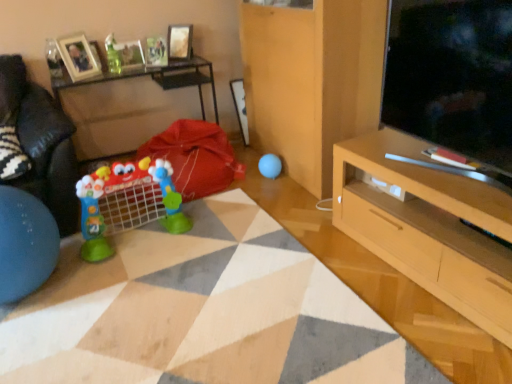
You are a GUI agent. You are given a task and a screenshot of the screen. Output one action in this format:
    pyautogui.click(x=<x>, y=<y>)
    Task: Click on the free spot below wooden photo frame at upper left, arranged as the third picture frame when viewed from the right (from a real-world perspective)
    The image size is (512, 384).
    Given the screenshot: What is the action you would take?
    pyautogui.click(x=81, y=76)